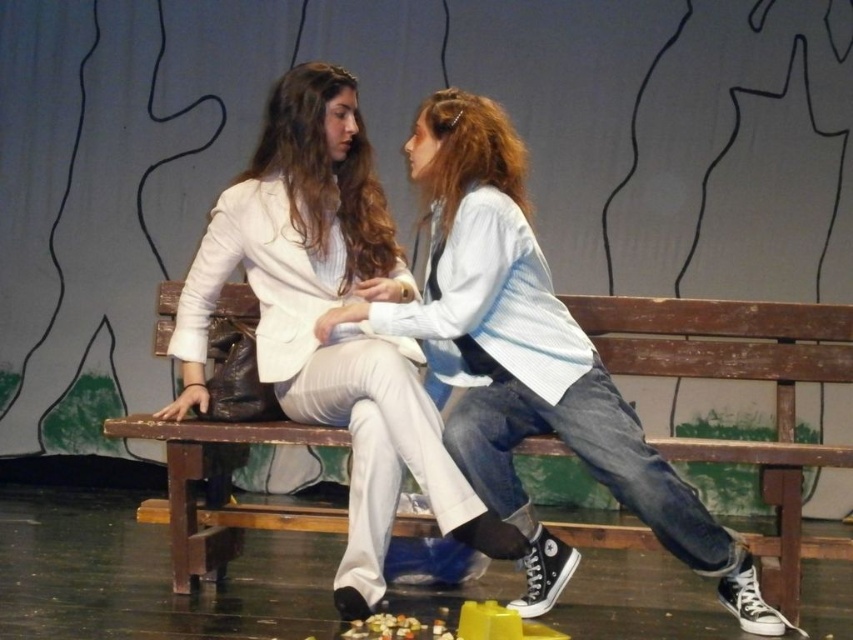
Is matte white blouse at center to the left of wooden bench at center from the viewer's perspective?

Indeed, matte white blouse at center is positioned on the left side of wooden bench at center.

Who is more distant from viewer, (460, 157) or (194, 561)?

The point (194, 561) is more distant.

Which is behind, point (465, 321) or point (405, 524)?

The point (405, 524) is more distant.

The image size is (853, 640). In order to click on matte white blouse at center in this screenshot , I will do `click(531, 362)`.

Is white matte blazer at center below wooden bench at center?

No.

Who is higher up, white matte blazer at center or wooden bench at center?

white matte blazer at center

Between point (357, 136) and point (207, 518), which one is positioned behind?

The point (207, 518) is behind.

Locate an element on the screen. white matte blazer at center is located at coordinates (334, 332).

Can you confirm if white matte blazer at center is positioned below matte white blouse at center?

No, white matte blazer at center is not below matte white blouse at center.

Which is behind, point (254, 154) or point (619, 394)?

The point (254, 154) is more distant.

Identify the location of white matte blazer at center. (334, 332).